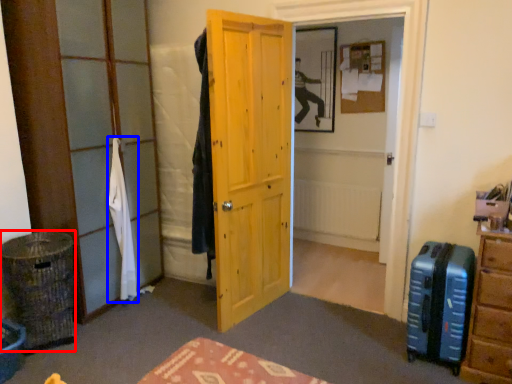
Question: Which of the following is the closest to the observer, laundry basket (highlighted by a red box) or clothing (highlighted by a blue box)?

Choices:
 (A) laundry basket
 (B) clothing

Answer: (A)